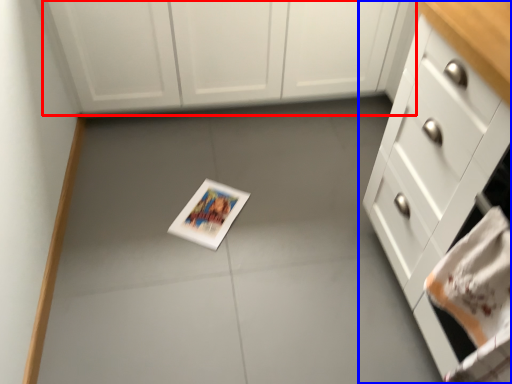
Question: Which point is closer to the camera, cabinetry (highlighted by a red box) or cabinetry (highlighted by a blue box)?

Choices:
 (A) cabinetry
 (B) cabinetry

Answer: (B)